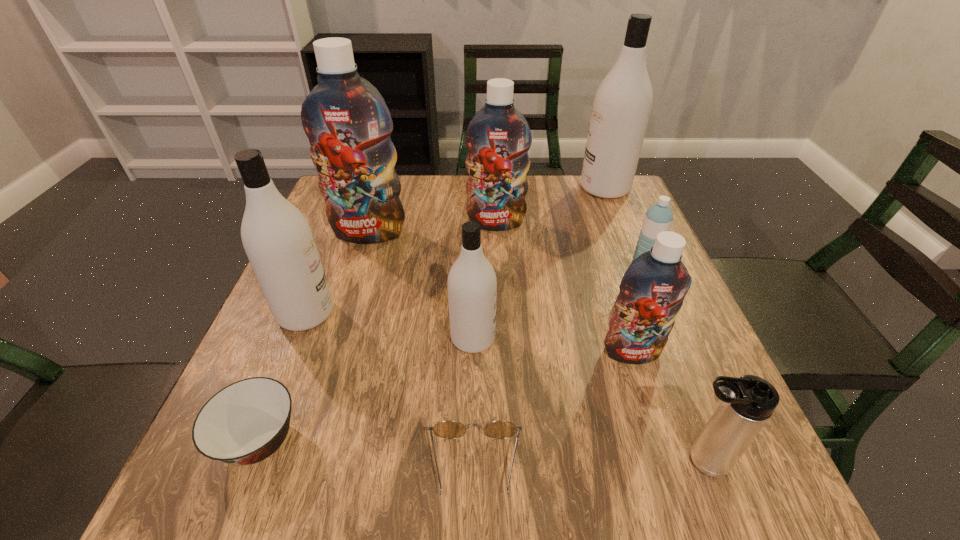
The width and height of the screenshot is (960, 540). In order to click on vacant space located on the front-facing side of the second white shampoo from left to right in this screenshot , I will do `click(698, 338)`.

Locate an element on the screen. This screenshot has height=540, width=960. vacant area situated on the front label of the nearest blue shampoo is located at coordinates (645, 393).

At what (x,y) coordinates should I click in order to perform the action: click on vacant space located on the back of the water bottle. Please return your answer as a coordinate pair (x, y). Looking at the image, I should click on (607, 188).

Find the location of a particular element. The width and height of the screenshot is (960, 540). free location located on the handle side of the thermos bottle is located at coordinates (608, 461).

Where is `vacant space located on the handle side of the thermos bottle`? Image resolution: width=960 pixels, height=540 pixels. vacant space located on the handle side of the thermos bottle is located at coordinates (435, 461).

At what (x,y) coordinates should I click in order to perform the action: click on free space located 0.160m on the handle side of the thermos bottle. Please return your answer as a coordinate pair (x, y). Looking at the image, I should click on (569, 461).

Image resolution: width=960 pixels, height=540 pixels. Identify the location of free space located on the back of the soup bowl. (328, 265).

The image size is (960, 540). Find the location of `thermos bottle located at the near edge`. thermos bottle located at the near edge is located at coordinates (745, 405).

Where is `soup bowl located in the near edge section of the desktop`? This screenshot has width=960, height=540. soup bowl located in the near edge section of the desktop is located at coordinates (244, 423).

You are a GUI agent. You are given a task and a screenshot of the screen. Output one action in this format:
    pyautogui.click(x=<x>, y=<y>)
    Task: Click on the spectacles that is positioned at the near edge
    The width and height of the screenshot is (960, 540).
    Given the screenshot: What is the action you would take?
    pyautogui.click(x=448, y=429)